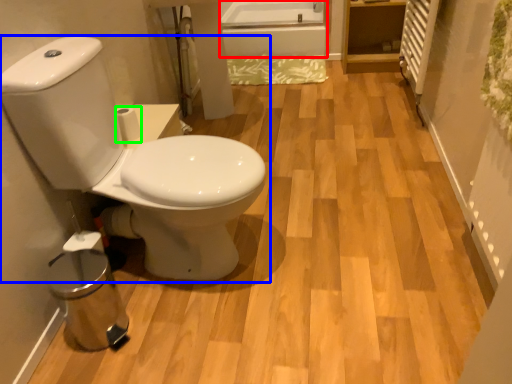
Question: Based on their relative distances, which object is nearer to bath (highlighted by a red box)? Choose from toilet (highlighted by a blue box) and toilet paper (highlighted by a green box).

Choices:
 (A) toilet
 (B) toilet paper

Answer: (B)